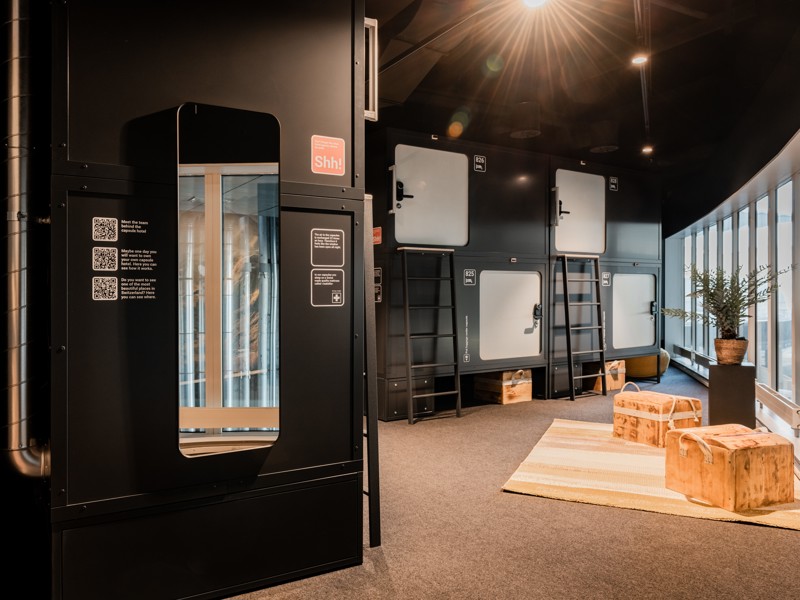
Find the location of `mirror`. mirror is located at coordinates (242, 318).